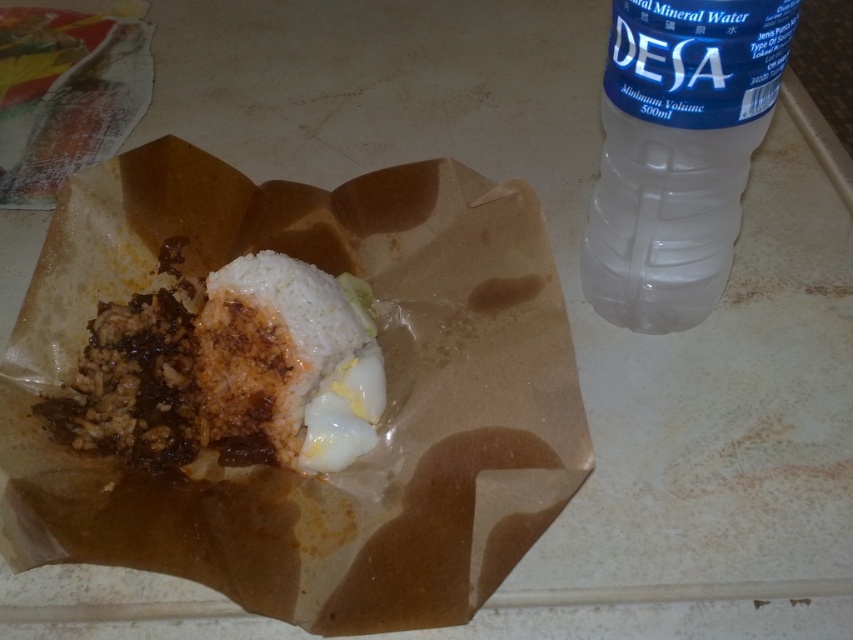
Question: Which point is farther to the camera?

Choices:
 (A) white matte rice at center
 (B) transparent plastic bottle at upper right

Answer: (A)

Question: Can you confirm if transparent plastic bottle at upper right is bigger than white matte rice at center?

Choices:
 (A) no
 (B) yes

Answer: (B)

Question: Where is transparent plastic bottle at upper right located in relation to white matte rice at center in the image?

Choices:
 (A) left
 (B) right

Answer: (B)

Question: Which of the following is the closest to the observer?

Choices:
 (A) white matte rice at center
 (B) transparent plastic bottle at upper right

Answer: (B)

Question: Can you confirm if transparent plastic bottle at upper right is positioned above white matte rice at center?

Choices:
 (A) yes
 (B) no

Answer: (A)

Question: Which point is farther from the camera taking this photo?

Choices:
 (A) (325, 424)
 (B) (654, 115)

Answer: (A)